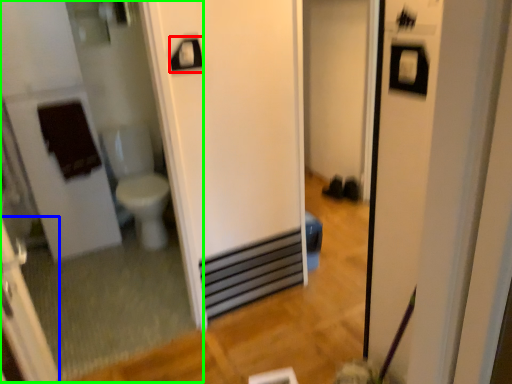
Question: Which is nearer to the towel bar (highlighted by a red box)? screen door (highlighted by a blue box) or mirror (highlighted by a green box).

Choices:
 (A) screen door
 (B) mirror

Answer: (A)